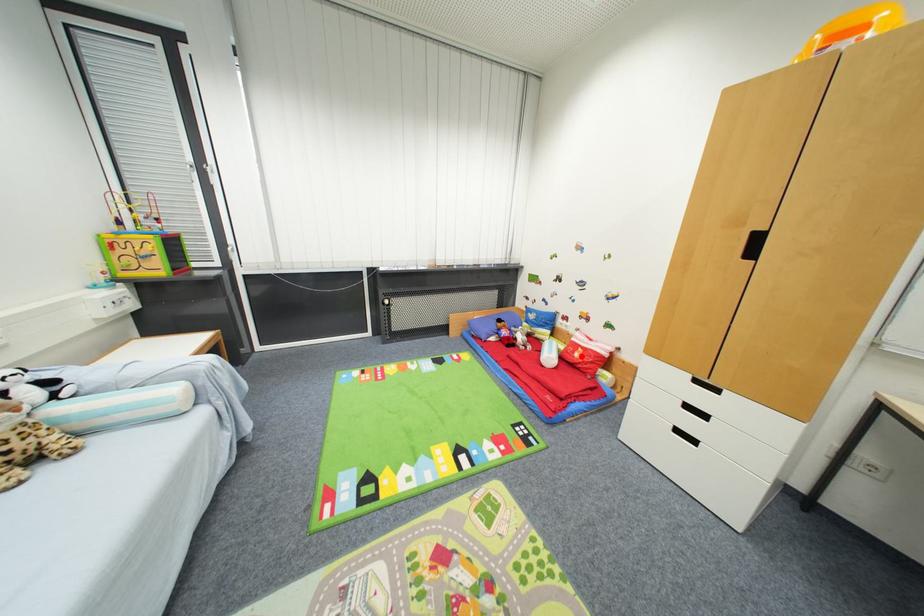
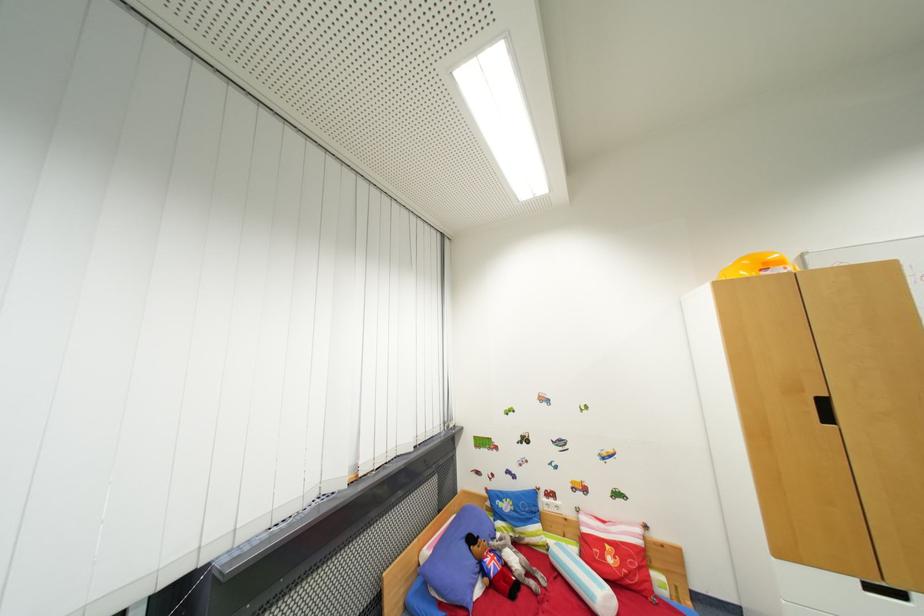
Question: A red point is marked in image1. In image2, is the corresponding 3D point closer to the camera or farther? Reply with the corresponding letter.

Choices:
 (A) The corresponding 3D point is closer.
 (B) The corresponding 3D point is farther.

Answer: (B)